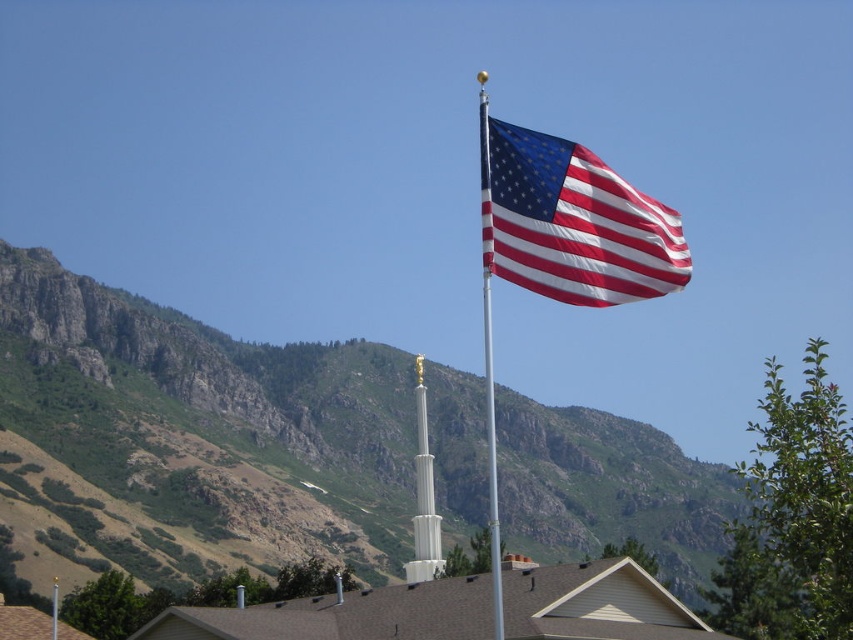
Who is higher up, matte fabric flag at upper center or silver metallic flag pole at upper center?

matte fabric flag at upper center is above.

Who is taller, matte fabric flag at upper center or silver metallic flag pole at upper center?

silver metallic flag pole at upper center

Who is more forward, (509, 186) or (479, 112)?

Positioned in front is point (509, 186).

Identify the location of matte fabric flag at upper center. (572, 221).

Can you confirm if green grassy mountain at upper center is positioned to the right of matte fabric flag at upper center?

In fact, green grassy mountain at upper center is to the left of matte fabric flag at upper center.

Is green grassy mountain at upper center bigger than matte fabric flag at upper center?

Indeed, green grassy mountain at upper center has a larger size compared to matte fabric flag at upper center.

You are a GUI agent. You are given a task and a screenshot of the screen. Output one action in this format:
    pyautogui.click(x=<x>, y=<y>)
    Task: Click on the green grassy mountain at upper center
    This screenshot has width=853, height=640.
    Given the screenshot: What is the action you would take?
    pyautogui.click(x=210, y=413)

This screenshot has width=853, height=640. In order to click on green grassy mountain at upper center in this screenshot , I will do `click(210, 413)`.

Which of these two, green grassy mountain at upper center or silver metallic flag pole at upper center, stands shorter?

Standing shorter between the two is green grassy mountain at upper center.

Where is `green grassy mountain at upper center`? The image size is (853, 640). green grassy mountain at upper center is located at coordinates (210, 413).